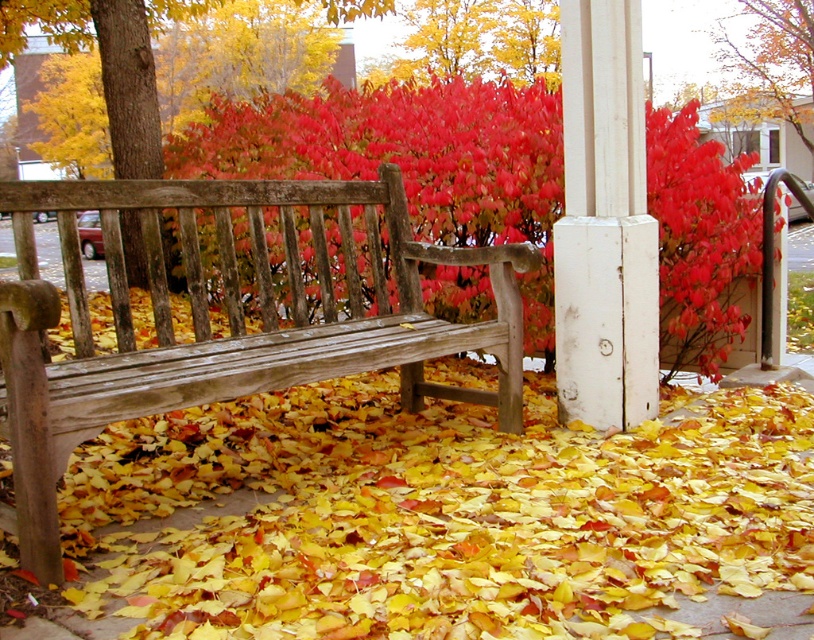
Question: Which of these objects is positioned closest to the white painted wood post at center?

Choices:
 (A) wooden bench at center
 (B) smooth red leaves at upper center

Answer: (A)

Question: Can you confirm if yellow wood bench at center is positioned below white painted wood post at center?

Choices:
 (A) no
 (B) yes

Answer: (B)

Question: Which point appears closest to the camera in this image?

Choices:
 (A) (425, 196)
 (B) (335, 371)
 (C) (594, 12)

Answer: (B)

Question: Is white painted wood post at center positioned in front of smooth red leaves at upper center?

Choices:
 (A) yes
 (B) no

Answer: (A)

Question: In this image, where is yellow wood bench at center located relative to white painted wood post at center?

Choices:
 (A) left
 (B) right

Answer: (A)

Question: Based on their relative distances, which object is nearer to the white painted wood post at center?

Choices:
 (A) smooth red leaves at upper center
 (B) vivid red leaves at center

Answer: (B)